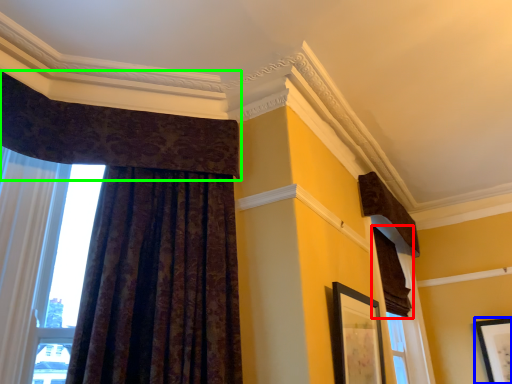
Question: Which is farther away from curtain (highlighted by a red box)? picture frame (highlighted by a blue box) or curtain (highlighted by a green box)?

Choices:
 (A) picture frame
 (B) curtain

Answer: (B)